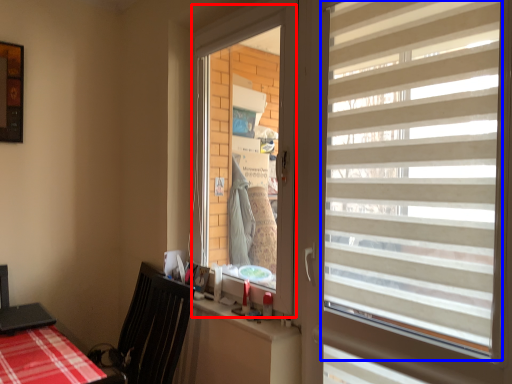
Question: Which point is further to the camera, window screen (highlighted by a red box) or window blind (highlighted by a blue box)?

Choices:
 (A) window screen
 (B) window blind

Answer: (A)